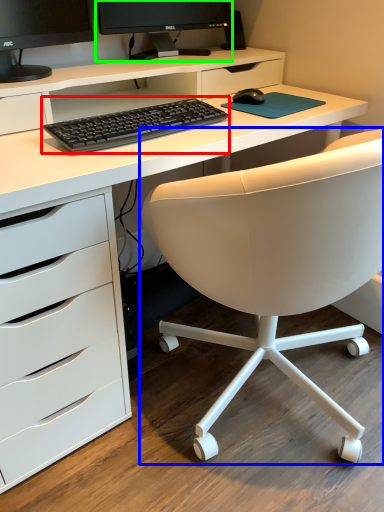
Question: Considering the real-world distances, which object is farthest from computer keyboard (highlighted by a red box)? chair (highlighted by a blue box) or computer monitor (highlighted by a green box)?

Choices:
 (A) chair
 (B) computer monitor

Answer: (B)